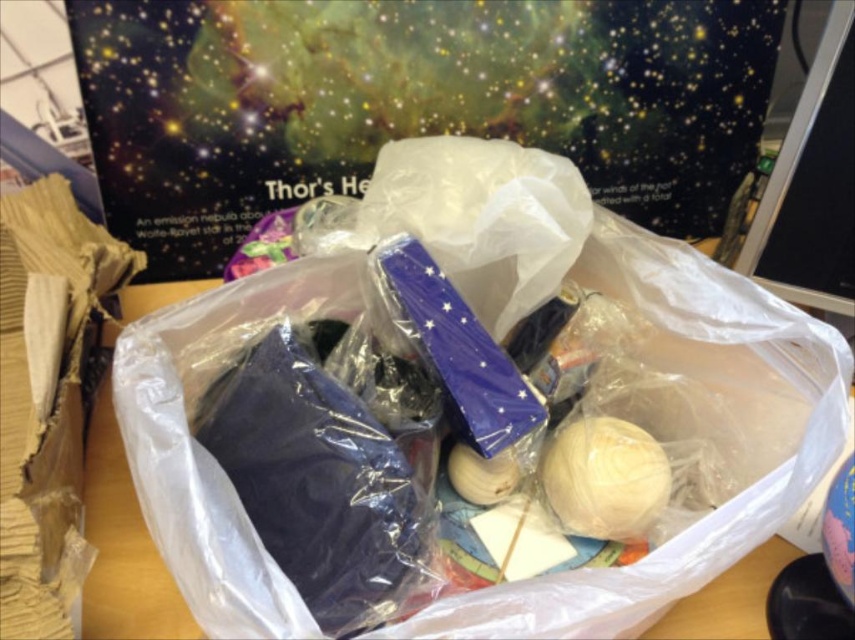
You are organizing items in the bin and need to place the smooth beige yarn at lower right behind the translucent plastic bag at center. Is this possible given their current positions?

The translucent plastic bag at center is closer to the viewer than the smooth beige yarn at lower right, so yes, you can place the smooth beige yarn at lower right behind the translucent plastic bag at center since it is already positioned further back.

You need to choose a container to store small craft supplies. You have the translucent plastic bag at center and the smooth beige yarn at lower right. Which one can hold more items due to its size?

The translucent plastic bag at center has a larger size compared to the smooth beige yarn at lower right, so it can hold more items.